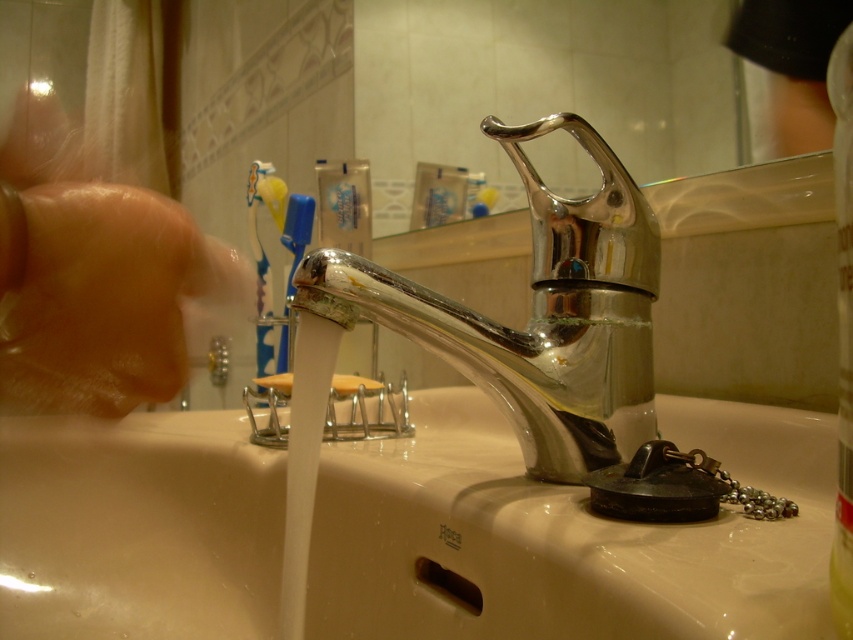
Can you confirm if white glossy sink at center is positioned to the right of dry skin at left?

Correct, you'll find white glossy sink at center to the right of dry skin at left.

Where is `white glossy sink at center`? This screenshot has width=853, height=640. white glossy sink at center is located at coordinates (566, 534).

Can you confirm if polished chrome faucet at center is positioned above white matte soap at center?

Yes.

Can you confirm if polished chrome faucet at center is positioned to the left of white matte soap at center?

Incorrect, polished chrome faucet at center is not on the left side of white matte soap at center.

Is point (425, 332) behind point (288, 394)?

No, it is not.

Image resolution: width=853 pixels, height=640 pixels. In order to click on polished chrome faucet at center in this screenshot , I will do `click(537, 314)`.

How much distance is there between dry skin at left and white matte soap at center?

A distance of 17.78 inches exists between dry skin at left and white matte soap at center.

Does dry skin at left have a greater height compared to white matte soap at center?

Indeed, dry skin at left has a greater height compared to white matte soap at center.

Who is more distant from viewer, (161, 218) or (338, 380)?

The point (338, 380) is behind.

Find the location of a particular element. Image resolution: width=853 pixels, height=640 pixels. dry skin at left is located at coordinates (100, 296).